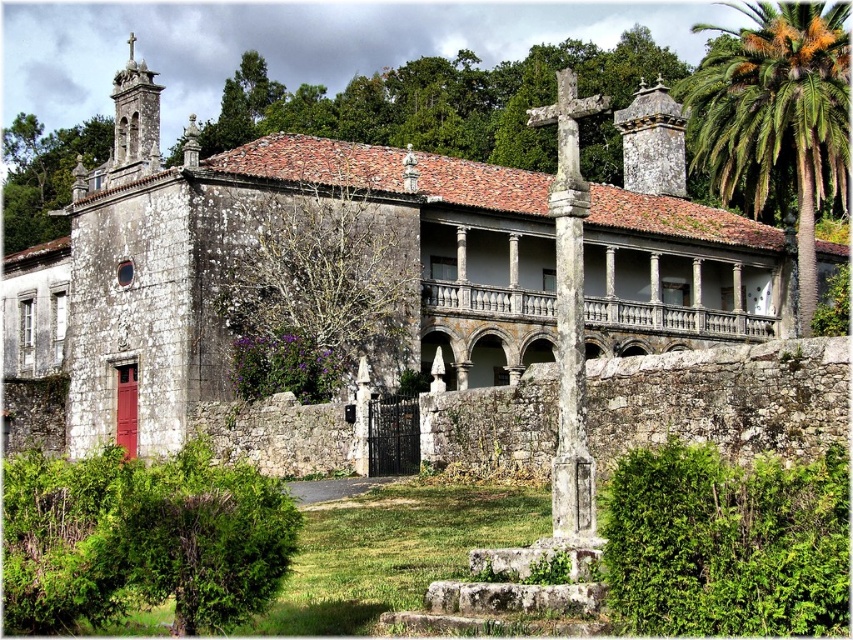
Who is taller, stone church at center or stone cross at center?

Standing taller between the two is stone church at center.

Does stone church at center lie behind stone cross at center?

Yes.

The width and height of the screenshot is (853, 640). What do you see at coordinates (257, 266) in the screenshot?
I see `stone church at center` at bounding box center [257, 266].

Where is `stone church at center`? This screenshot has width=853, height=640. stone church at center is located at coordinates click(x=257, y=266).

Who is positioned more to the right, green leafy palm at upper right or stone cross at center?

green leafy palm at upper right

Does green leafy palm at upper right have a greater height compared to stone cross at center?

Yes, green leafy palm at upper right is taller than stone cross at center.

Identify the location of green leafy palm at upper right. Image resolution: width=853 pixels, height=640 pixels. (775, 115).

Find the location of `green leafy palm at upper right`. green leafy palm at upper right is located at coordinates (775, 115).

Is stone church at center further to camera compared to green leafy palm at upper right?

No, it is not.

Is stone church at center shorter than green leafy palm at upper right?

No.

Find the location of `stone church at center`. stone church at center is located at coordinates (257, 266).